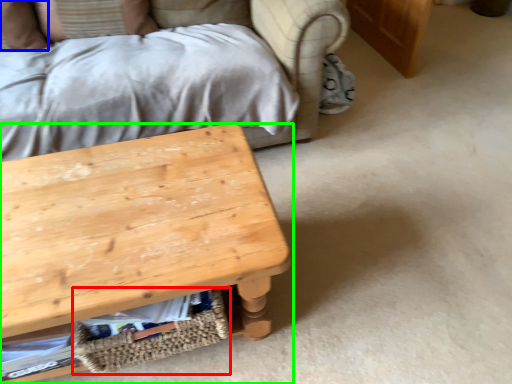
Question: Based on their relative distances, which object is farther from basket (highlighted by a red box)? Choose from pillow (highlighted by a blue box) and table (highlighted by a green box).

Choices:
 (A) pillow
 (B) table

Answer: (A)